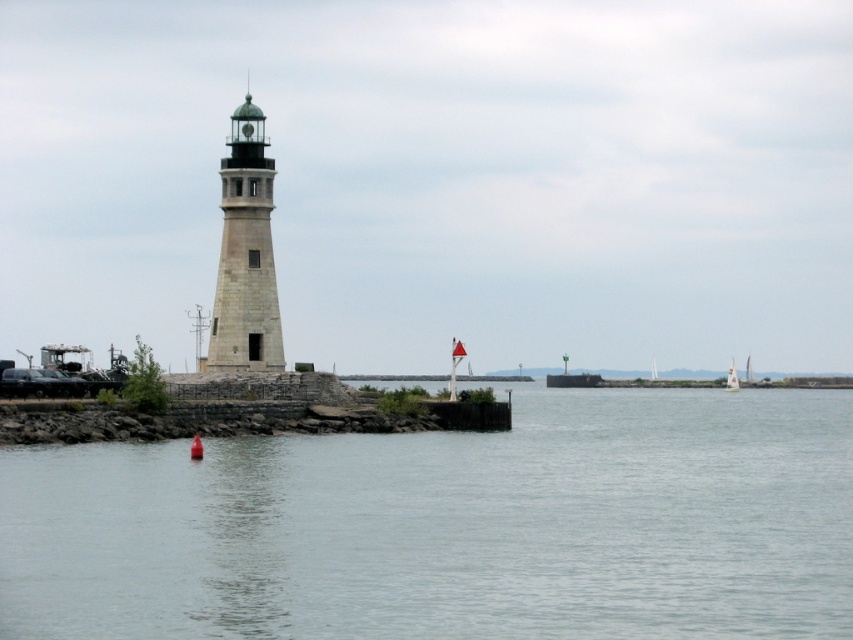
You are standing at the lighthouse and want to determine which of the two points, point (x=271, y=480) or point (x=234, y=268), is closer to you. Based on the scene, which point is nearer?

Point (x=271, y=480) is closer to the viewer than point (x=234, y=268).

Consider the image. You are standing on the beach looking at the white stone lighthouse at left. There is a point marked at coordinates [245,256]. Where is this point located?

The point marked at coordinates [245,256] is located on the white stone lighthouse at left.